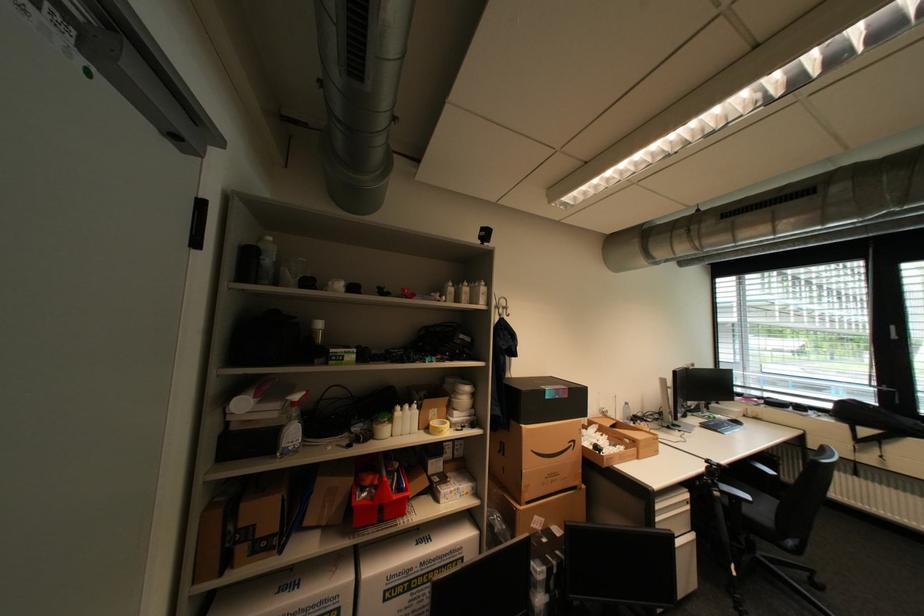
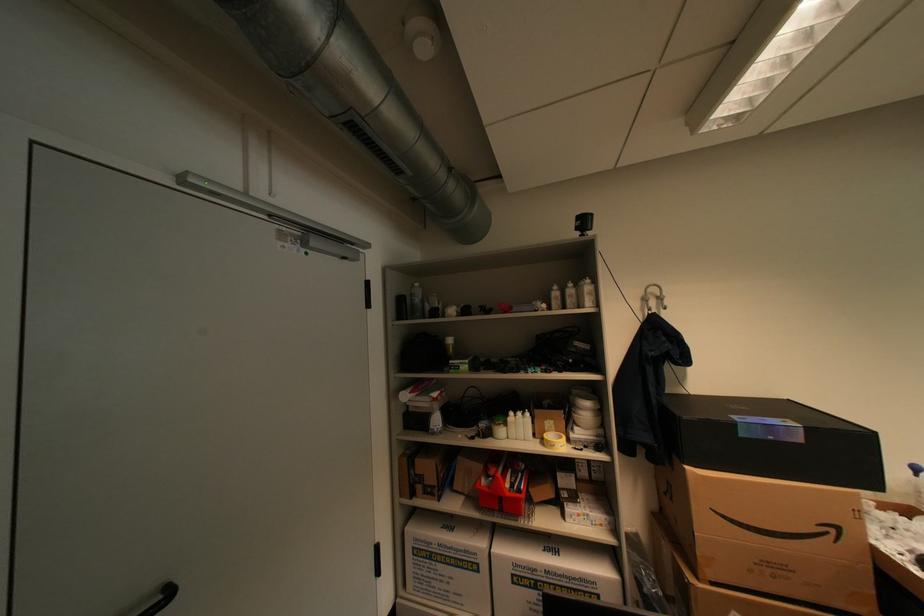
Locate, in the second image, the point that corresponds to pixel 407 408 in the first image.

(519, 414)